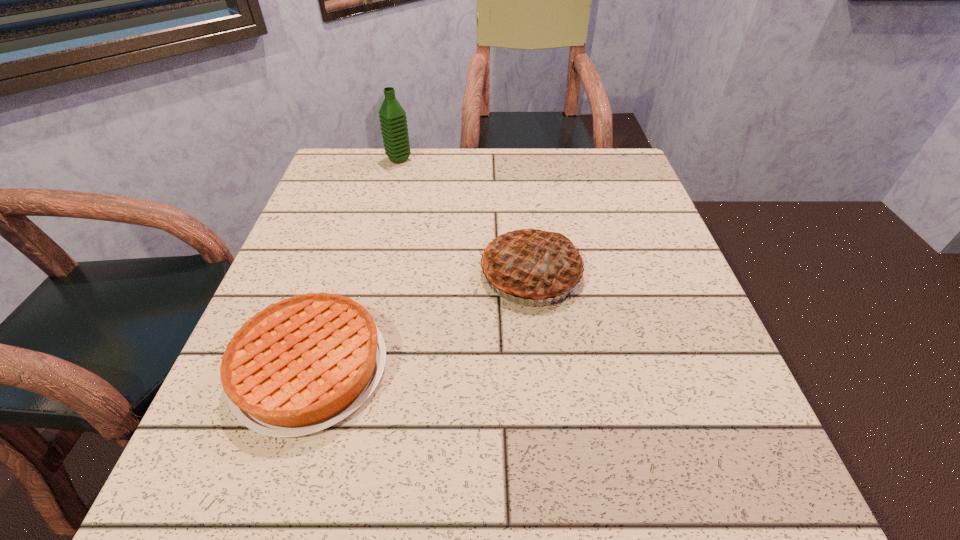
The width and height of the screenshot is (960, 540). I want to click on water bottle, so click(x=392, y=116).

This screenshot has height=540, width=960. In order to click on the tallest object in this screenshot , I will do `click(392, 116)`.

Locate an element on the screen. This screenshot has height=540, width=960. the taller pie is located at coordinates (531, 263).

Identify the location of the second tallest object. (531, 263).

Locate an element on the screen. The height and width of the screenshot is (540, 960). the shortest object is located at coordinates (303, 364).

Identify the location of the shorter pie. (303, 364).

In order to click on free spot located 0.280m on the right of the tallest object in this screenshot , I will do `click(515, 159)`.

Identify the location of free region located on the right of the right pie. (636, 273).

Where is `free space located on the right of the shortest object`? The height and width of the screenshot is (540, 960). free space located on the right of the shortest object is located at coordinates (549, 368).

Identify the location of object situated at the far edge. click(392, 116).